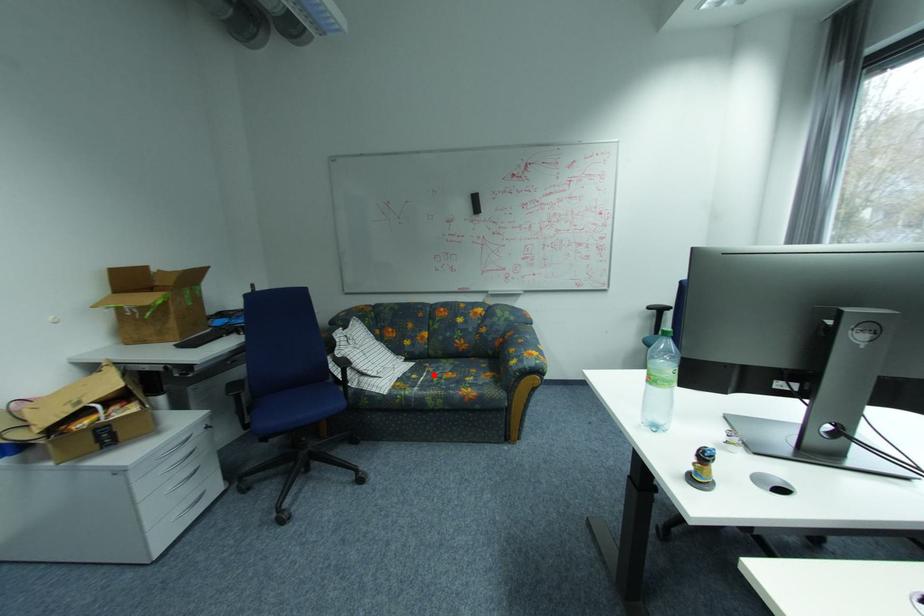
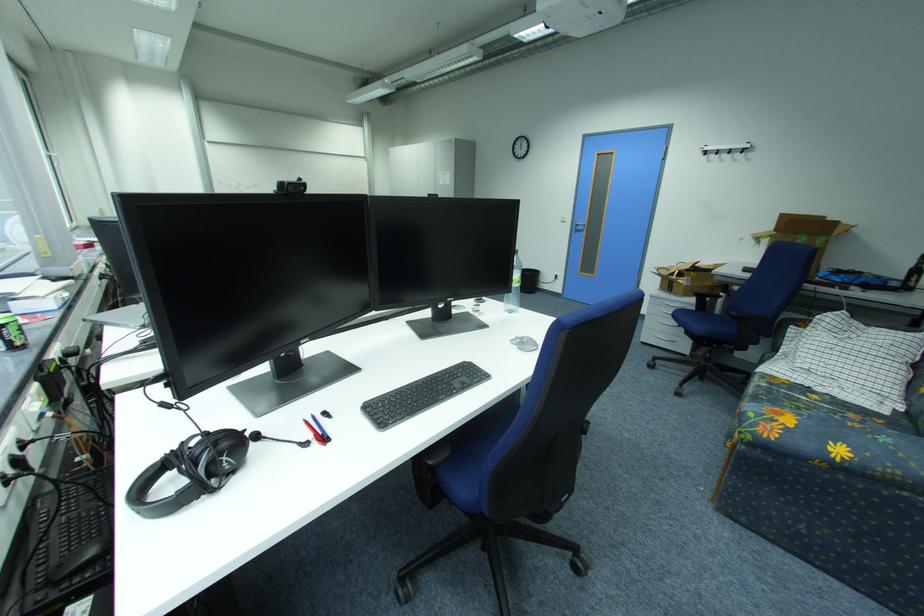
Question: I am providing you with two images of the same scene from different viewpoints. In image1, a red point is highlighted. Considering the same 3D point in image2, which of the following is correct?

Choices:
 (A) It is closer
 (B) It is farther

Answer: (B)